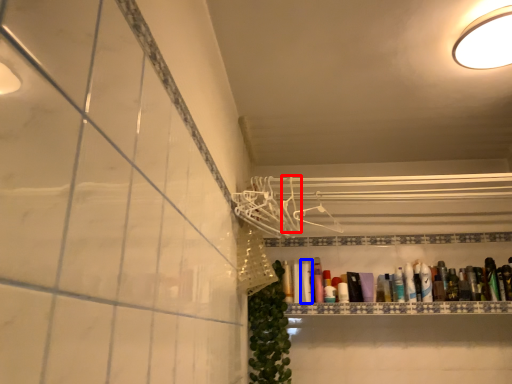
Question: Which object appears closest to the camera in this image, hanger (highlighted by a red box) or toiletry (highlighted by a blue box)?

Choices:
 (A) hanger
 (B) toiletry

Answer: (A)